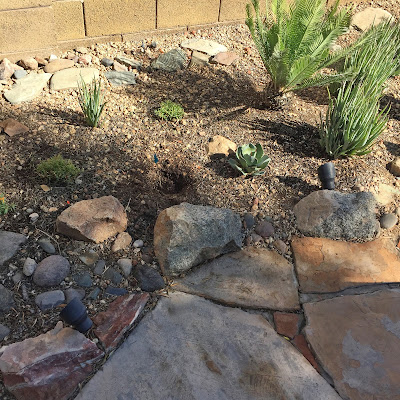
Identify the location of wall. Image resolution: width=400 pixels, height=400 pixels. pos(56,34).